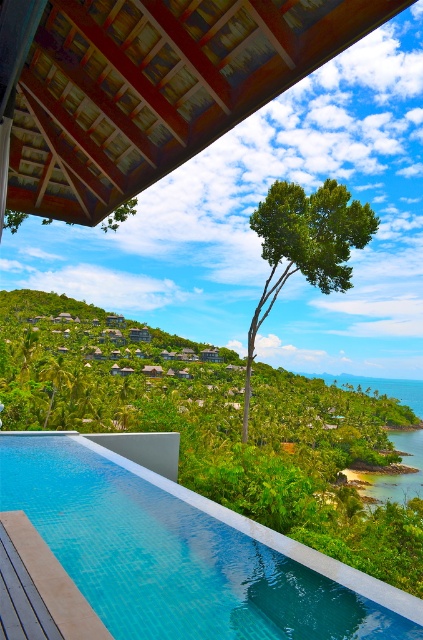
Question: Does clear glass pool at center have a smaller size compared to green leafy tree at center?

Choices:
 (A) no
 (B) yes

Answer: (B)

Question: Observing the image, what is the correct spatial positioning of clear glass pool at center in reference to green leafy tree at center?

Choices:
 (A) above
 (B) below

Answer: (A)

Question: Which of the following is the farthest from the observer?

Choices:
 (A) pyautogui.click(x=288, y=573)
 (B) pyautogui.click(x=318, y=262)

Answer: (B)

Question: Which point appears farthest from the camera in this image?

Choices:
 (A) (71, 524)
 (B) (326, 256)

Answer: (B)

Question: Which object appears closest to the camera in this image?

Choices:
 (A) green leafy tree at center
 (B) clear glass pool at center

Answer: (B)

Question: Can you confirm if clear glass pool at center is bigger than green leafy tree at center?

Choices:
 (A) no
 (B) yes

Answer: (A)